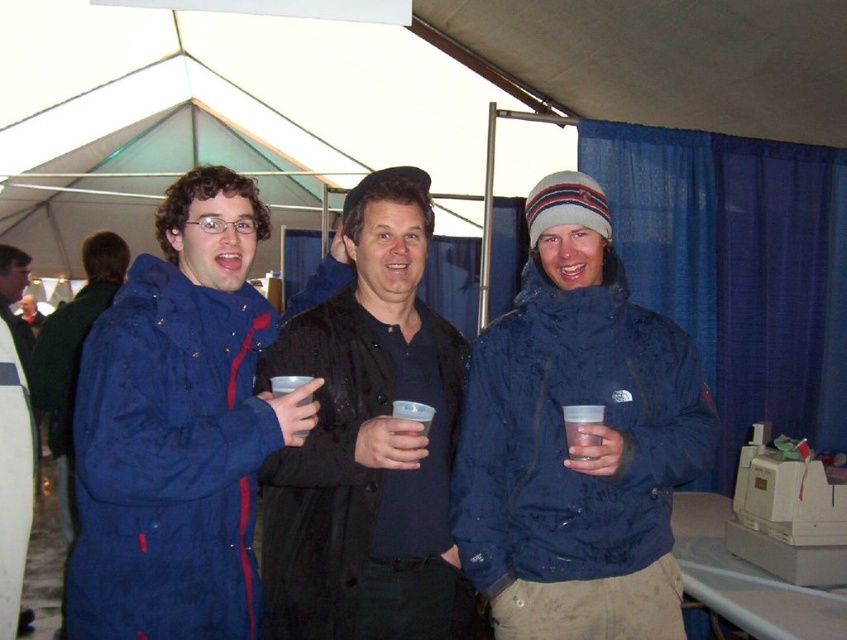
Question: Does matte blue coat at left have a lesser width compared to black matte jacket at center?

Choices:
 (A) yes
 (B) no

Answer: (B)

Question: Which point is closer to the camera?

Choices:
 (A) black matte jacket at center
 (B) matte blue coat at left

Answer: (B)

Question: Which point appears farthest from the camera in this image?

Choices:
 (A) [519, 316]
 (B) [432, 593]
 (C) [128, 445]

Answer: (A)

Question: Can you confirm if blue matte jacket at center is wider than black matte jacket at center?

Choices:
 (A) no
 (B) yes

Answer: (B)

Question: Is matte blue coat at left thinner than black matte jacket at center?

Choices:
 (A) yes
 (B) no

Answer: (B)

Question: Which point appears closest to the camera in this image?

Choices:
 (A) (662, 509)
 (B) (119, 547)

Answer: (B)